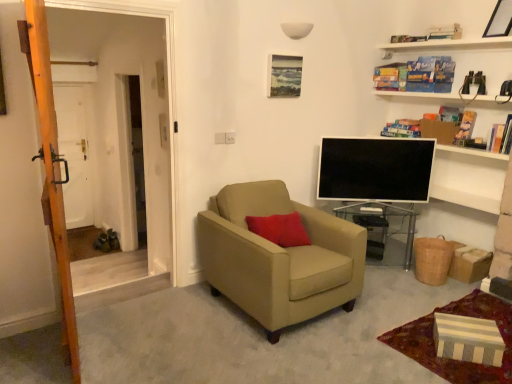
Question: Should I look upward or downward to see matte wooden picture frame at upper center, which is counted as the first picture frame, starting from the left?

Choices:
 (A) up
 (B) down

Answer: (A)

Question: Is white matte door at left next to hardcover book at upper right, which is the fifth book in top-to-bottom order, and touching it?

Choices:
 (A) no
 (B) yes

Answer: (A)

Question: From a real-world perspective, is white matte door at left on hardcover book at upper right, which is the fifth book in top-to-bottom order?

Choices:
 (A) no
 (B) yes

Answer: (A)

Question: Considering the relative positions of white matte door at left and hardcover book at upper right, the first book from the bottom, in the image provided, is white matte door at left behind hardcover book at upper right, the first book from the bottom,?

Choices:
 (A) no
 (B) yes

Answer: (B)

Question: Are white matte door at left and hardcover book at upper right, the first book from the bottom, located far from each other?

Choices:
 (A) yes
 (B) no

Answer: (A)

Question: Is white matte door at left taller than hardcover book at upper right, the first book from the bottom?

Choices:
 (A) yes
 (B) no

Answer: (A)

Question: Can you confirm if white matte door at left is positioned to the right of hardcover book at upper right, which is the fifth book in top-to-bottom order?

Choices:
 (A) yes
 (B) no

Answer: (B)

Question: Is white matte door at left positioned before beige fabric armchair at center?

Choices:
 (A) no
 (B) yes

Answer: (A)

Question: Is white matte door at left facing away from beige fabric armchair at center?

Choices:
 (A) no
 (B) yes

Answer: (A)

Question: Can you confirm if white matte door at left is shorter than beige fabric armchair at center?

Choices:
 (A) no
 (B) yes

Answer: (A)

Question: Is white matte door at left surrounding beige fabric armchair at center?

Choices:
 (A) no
 (B) yes

Answer: (A)

Question: Is white matte door at left smaller than beige fabric armchair at center?

Choices:
 (A) no
 (B) yes

Answer: (B)

Question: Is white matte door at left oriented towards beige fabric armchair at center?

Choices:
 (A) no
 (B) yes

Answer: (A)

Question: From a real-world perspective, is wooden picture frame at upper right, the 2th picture frame viewed from the left, beneath wooden ladder at left?

Choices:
 (A) yes
 (B) no

Answer: (B)